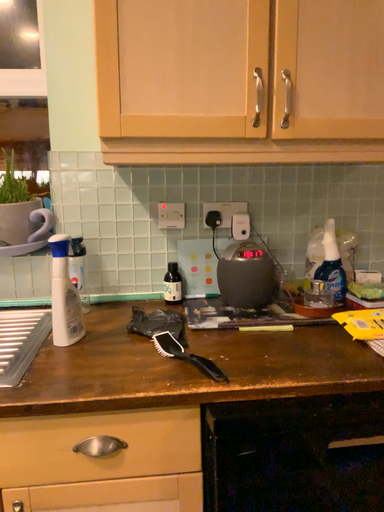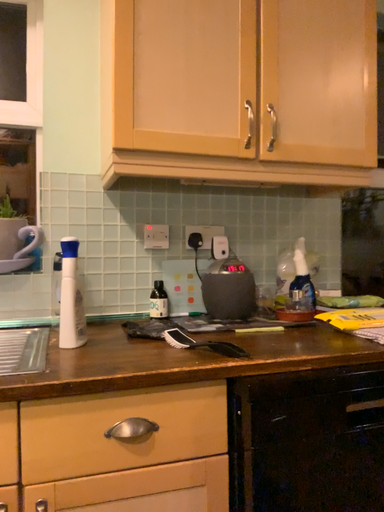
Question: How did the camera likely rotate when shooting the video?

Choices:
 (A) rotated left
 (B) rotated right

Answer: (B)